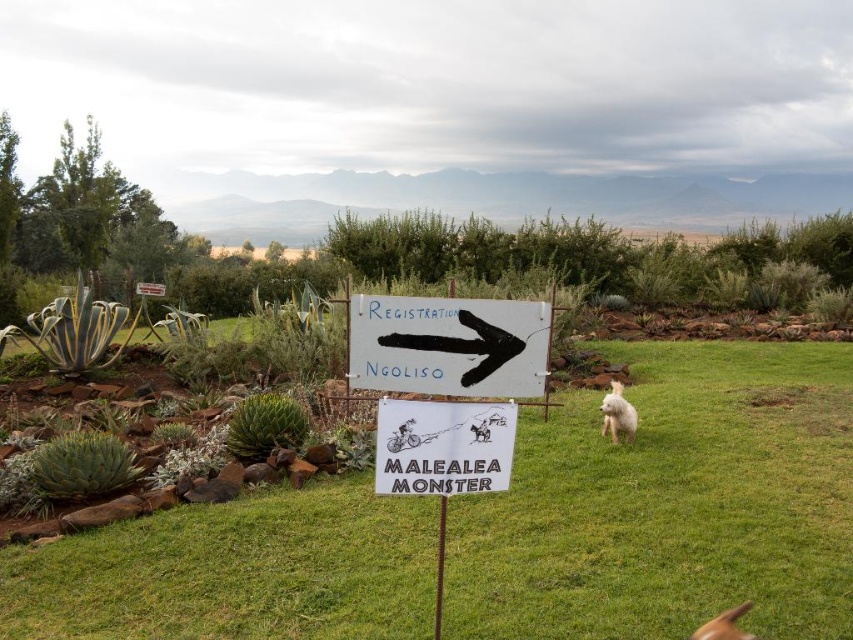
Does green grass at center have a lesser height compared to black painted arrow at center?

Yes, green grass at center is shorter than black painted arrow at center.

Which is in front, point (689, 536) or point (384, 346)?

Positioned in front is point (384, 346).

Is point (183, 582) farther from camera compared to point (508, 332)?

Yes, it is behind point (508, 332).

Identify the location of green grass at center. (670, 504).

Between point (476, 484) and point (621, 429), which one is positioned in front?

Point (476, 484)

Locate an element on the screen. Image resolution: width=853 pixels, height=640 pixels. white paper sign at center is located at coordinates (444, 445).

Between black painted arrow at center and white fluffy dog at right, which one has less height?

black painted arrow at center

Does black painted arrow at center have a lesser height compared to white fluffy dog at right?

Yes, black painted arrow at center is shorter than white fluffy dog at right.

Where is `black painted arrow at center`? This screenshot has height=640, width=853. black painted arrow at center is located at coordinates (448, 346).